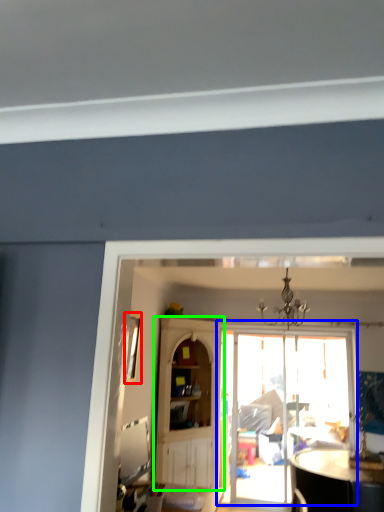
Question: Based on their relative distances, which object is nearer to window (highlighted by a red box)? Choose from door (highlighted by a blue box) and cabinetry (highlighted by a green box).

Choices:
 (A) door
 (B) cabinetry

Answer: (B)